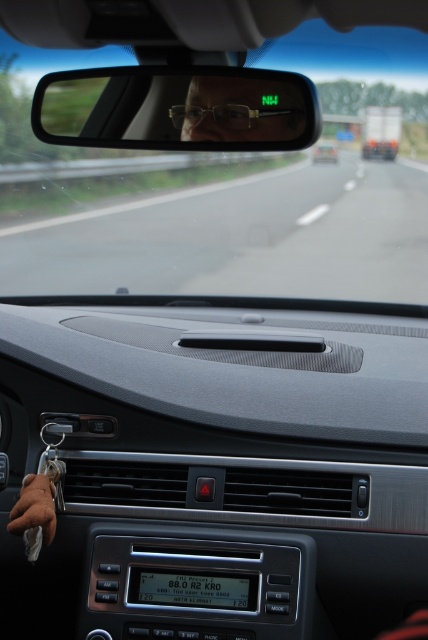
What do you see at coordinates (177, 108) in the screenshot?
I see `clear plastic mirror at center` at bounding box center [177, 108].

Does clear plastic mirror at center appear on the left side of matte black glasses at center?

Correct, you'll find clear plastic mirror at center to the left of matte black glasses at center.

Is point (110, 104) behind point (291, 116)?

Yes, it is behind point (291, 116).

Locate an element on the screen. The image size is (428, 640). clear plastic mirror at center is located at coordinates (177, 108).

Based on the photo, which of these two, transparent glass windshield at upper center or matte black glasses at center, stands taller?

transparent glass windshield at upper center

Is transparent glass windshield at upper center positioned before matte black glasses at center?

Yes, it is.

The width and height of the screenshot is (428, 640). What do you see at coordinates (214, 225) in the screenshot?
I see `transparent glass windshield at upper center` at bounding box center [214, 225].

This screenshot has height=640, width=428. Find the location of `transparent glass windshield at upper center`. transparent glass windshield at upper center is located at coordinates (214, 225).

Can you confirm if transparent glass windshield at upper center is bigger than clear plastic mirror at center?

Yes.

Is transparent glass windshield at upper center taller than clear plastic mirror at center?

Correct, transparent glass windshield at upper center is much taller as clear plastic mirror at center.

Measure the distance between transparent glass windshield at upper center and camera.

transparent glass windshield at upper center is 2.21 meters from camera.

I want to click on transparent glass windshield at upper center, so click(214, 225).